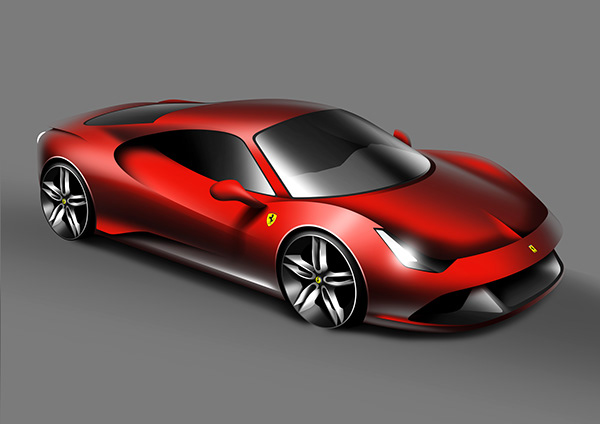
Where is `right mirror`? The image size is (600, 424). right mirror is located at coordinates (237, 188).